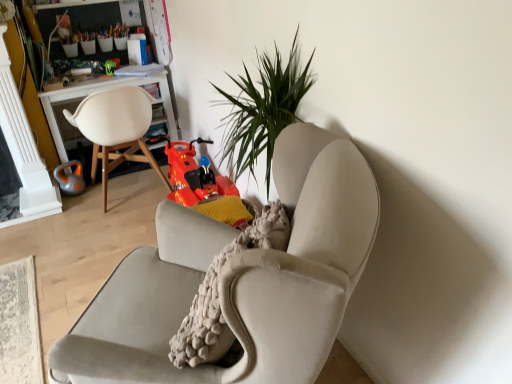
Question: From the image's perspective, is shiny green toy at upper left, placed as the second toy when sorted from bottom to top, below orange rubber kettlebell at left, which is the second toy from top to bottom?

Choices:
 (A) yes
 (B) no

Answer: (B)

Question: Can you confirm if shiny green toy at upper left, placed as the second toy when sorted from bottom to top, is wider than orange rubber kettlebell at left, which is the second toy from top to bottom?

Choices:
 (A) yes
 (B) no

Answer: (B)

Question: From a real-world perspective, is shiny green toy at upper left, which is the 2th toy in left-to-right order, positioned under orange rubber kettlebell at left, the first toy positioned from the bottom, based on gravity?

Choices:
 (A) yes
 (B) no

Answer: (B)

Question: Considering the relative sizes of shiny green toy at upper left, which appears as the 1th toy when viewed from the top, and orange rubber kettlebell at left, acting as the 1th toy starting from the left, in the image provided, is shiny green toy at upper left, which appears as the 1th toy when viewed from the top, taller than orange rubber kettlebell at left, acting as the 1th toy starting from the left,?

Choices:
 (A) no
 (B) yes

Answer: (A)

Question: Could orange rubber kettlebell at left, the first toy positioned from the bottom, be considered to be inside shiny green toy at upper left, which appears as the 1th toy when viewed from the top?

Choices:
 (A) yes
 (B) no

Answer: (B)

Question: Can you confirm if shiny green toy at upper left, the first toy when ordered from right to left, is positioned to the left of orange rubber kettlebell at left, marked as the second toy in a right-to-left arrangement?

Choices:
 (A) yes
 (B) no

Answer: (B)

Question: From a real-world perspective, does white matte chair at left, placed as the 2th chair when sorted from right to left, stand above velvet beige armchair at center, the 1th chair viewed from the right?

Choices:
 (A) no
 (B) yes

Answer: (B)

Question: Is white matte chair at left, which is counted as the 1th chair, starting from the left, bigger than velvet beige armchair at center, the second chair from the left?

Choices:
 (A) yes
 (B) no

Answer: (A)

Question: From the image's perspective, is white matte chair at left, placed as the 2th chair when sorted from right to left, below velvet beige armchair at center, the second chair from the left?

Choices:
 (A) yes
 (B) no

Answer: (B)

Question: Does white matte chair at left, which is counted as the 1th chair, starting from the left, appear on the left side of velvet beige armchair at center, the 1th chair viewed from the right?

Choices:
 (A) no
 (B) yes

Answer: (B)

Question: Can you see white matte chair at left, placed as the 2th chair when sorted from right to left, touching velvet beige armchair at center, the 1th chair viewed from the right?

Choices:
 (A) no
 (B) yes

Answer: (A)

Question: Is white matte chair at left, placed as the 2th chair when sorted from right to left, oriented towards velvet beige armchair at center, the second chair from the left?

Choices:
 (A) no
 (B) yes

Answer: (A)

Question: Does white wood desk at left have a lesser height compared to shiny green toy at upper left, the first toy when ordered from right to left?

Choices:
 (A) yes
 (B) no

Answer: (B)